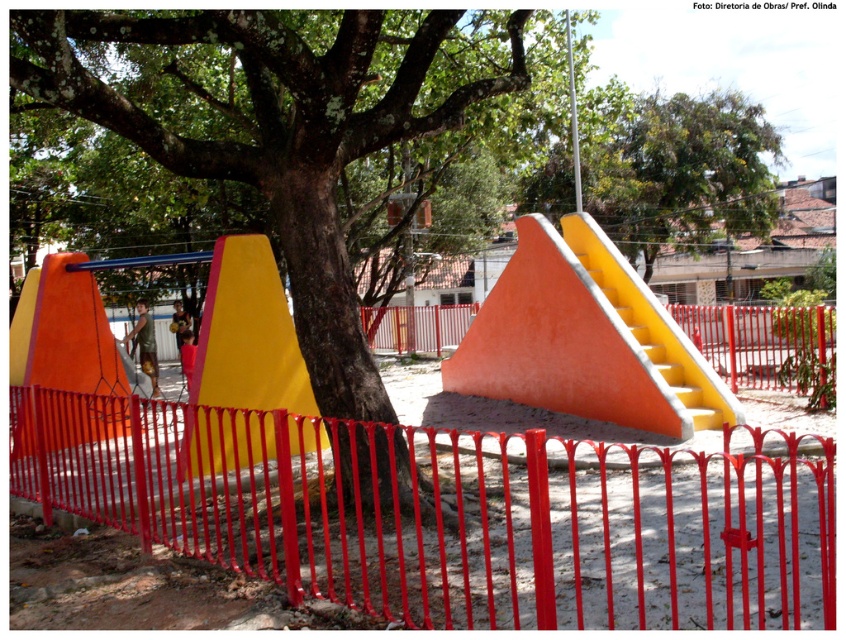
Question: Among these objects, which one is farthest from the camera?

Choices:
 (A) yellow matte slide at center
 (B) green leafy tree at upper center
 (C) red metal fence at center
 (D) green rough bark tree at center

Answer: (B)

Question: Which object is the farthest from the green leafy tree at upper center?

Choices:
 (A) red metal fence at center
 (B) green rough bark tree at center

Answer: (A)

Question: Is green leafy tree at upper center behind metallic pole at upper center?

Choices:
 (A) no
 (B) yes

Answer: (B)

Question: Is green leafy tree at upper center positioned at the back of metallic pole at upper center?

Choices:
 (A) no
 (B) yes

Answer: (B)

Question: Does red metal fence at center appear under green rough bark tree at center?

Choices:
 (A) yes
 (B) no

Answer: (A)

Question: Among these objects, which one is farthest from the camera?

Choices:
 (A) green rough bark tree at center
 (B) red metal fence at center
 (C) yellow matte slide at center

Answer: (A)